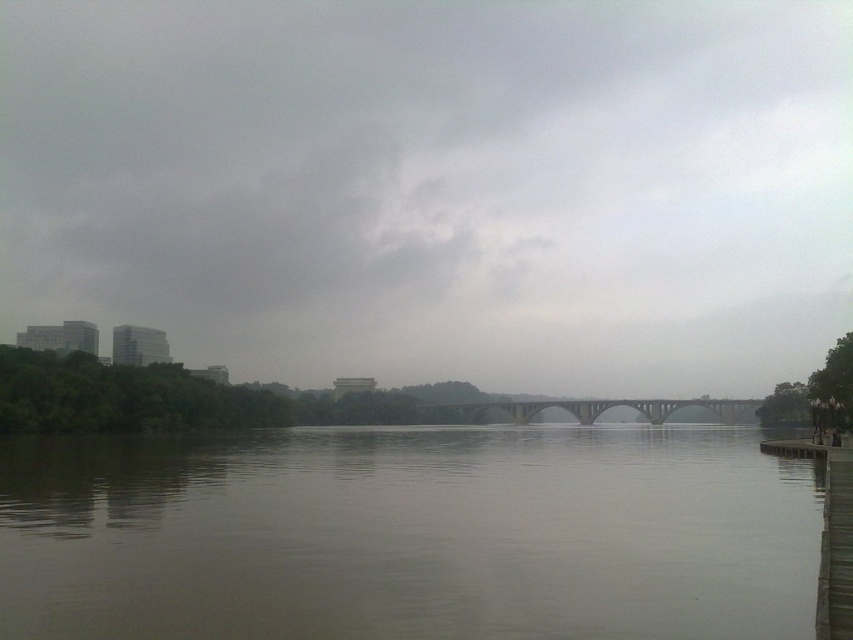
Is brown wooden dock at lower right to the left of concrete bridge at center from the viewer's perspective?

Indeed, brown wooden dock at lower right is positioned on the left side of concrete bridge at center.

Which of these two, brown wooden dock at lower right or concrete bridge at center, stands taller?

With more height is concrete bridge at center.

This screenshot has width=853, height=640. Find the location of `brown wooden dock at lower right`. brown wooden dock at lower right is located at coordinates (828, 532).

Find the location of `brown wooden dock at lower right`. brown wooden dock at lower right is located at coordinates (828, 532).

Does gray cloudy sky at upper center have a larger size compared to brown matte water at center?

Yes.

Who is lower down, gray cloudy sky at upper center or brown matte water at center?

brown matte water at center

Who is more forward, (734, 323) or (250, 573)?

Positioned in front is point (250, 573).

In order to click on gray cloudy sky at upper center in this screenshot , I will do `click(436, 186)`.

Looking at this image, can you confirm if gray cloudy sky at upper center is taller than brown wooden dock at lower right?

Yes, gray cloudy sky at upper center is taller than brown wooden dock at lower right.

Is point (521, 17) closer to camera compared to point (844, 564)?

That is False.

Which is behind, point (86, 42) or point (827, 577)?

The point (86, 42) is more distant.

You are a GUI agent. You are given a task and a screenshot of the screen. Output one action in this format:
    pyautogui.click(x=<x>, y=<y>)
    Task: Click on the gray cloudy sky at upper center
    This screenshot has width=853, height=640.
    Given the screenshot: What is the action you would take?
    [x=436, y=186]